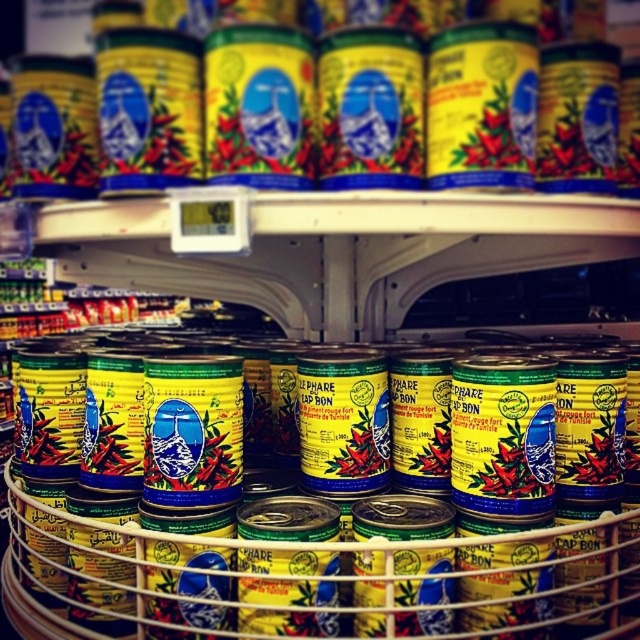
Question: Does yellow matte can at center have a larger size compared to yellow matte can at upper center?

Choices:
 (A) no
 (B) yes

Answer: (B)

Question: Among these objects, which one is nearest to the camera?

Choices:
 (A) yellow matte can at center
 (B) yellow matte can at upper center

Answer: (A)

Question: Which of the following is the farthest from the observer?

Choices:
 (A) (620, 589)
 (B) (76, 29)

Answer: (B)

Question: Which of the following is the closest to the observer?

Choices:
 (A) (90, 3)
 (B) (209, 550)

Answer: (B)

Question: In this image, where is yellow matte can at center located relative to yellow matte can at upper center?

Choices:
 (A) right
 (B) left

Answer: (A)

Question: Is yellow matte can at center wider than yellow matte can at upper center?

Choices:
 (A) yes
 (B) no

Answer: (A)